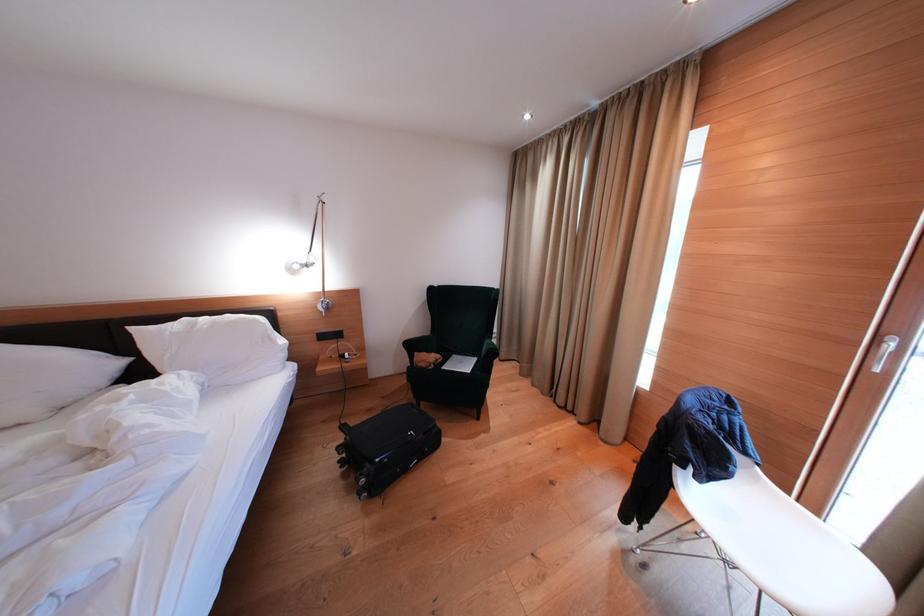
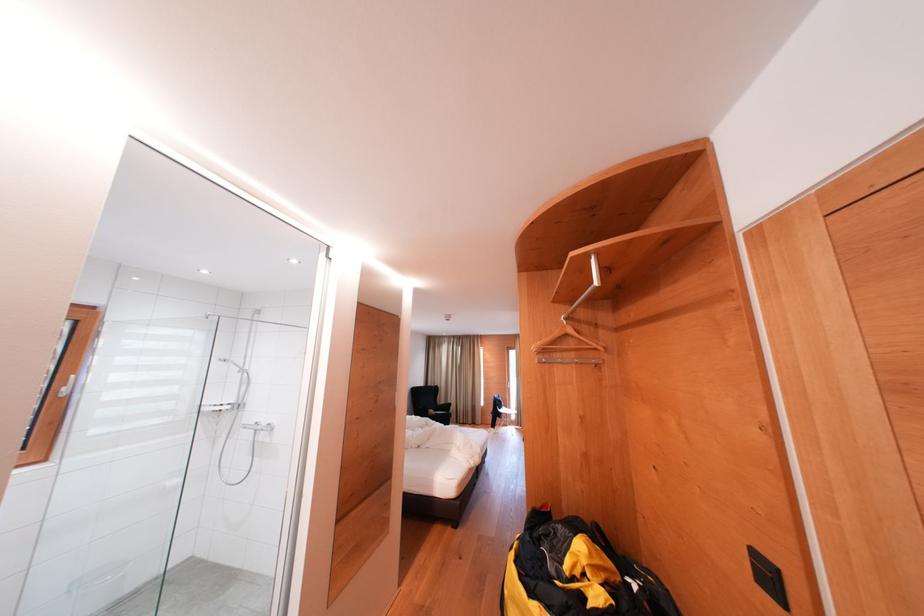
In the second image, find the point that corresponds to pixel 434 362 in the first image.

(439, 416)